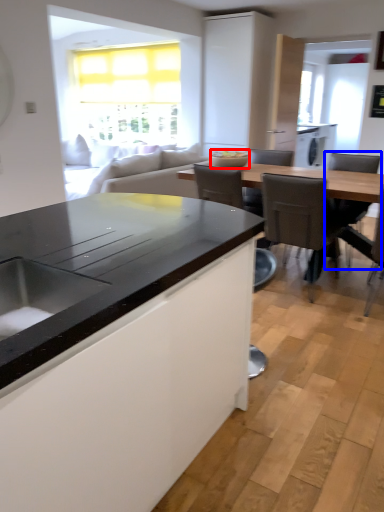
Question: Which of the following is the farthest to the observer, appliance (highlighted by a red box) or chair (highlighted by a blue box)?

Choices:
 (A) appliance
 (B) chair

Answer: (A)